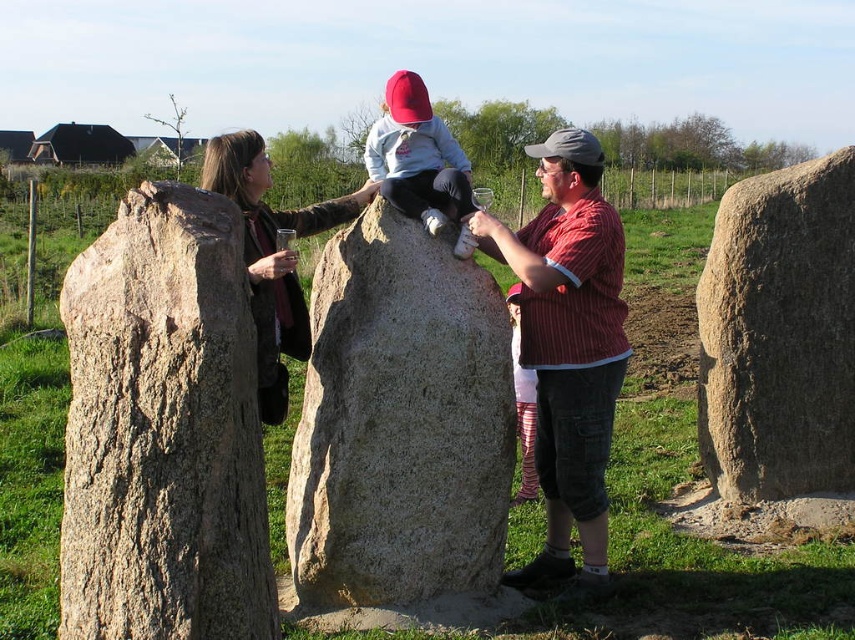
You are standing at the base of the standing stones and want to place a small offering at the point closest to you between the two points marked as point (248, 461) and point (319, 355). Which point should you go to?

Point (248, 461) is in front of point (319, 355), so you should go to point (248, 461) to place your offering.

You are a tour guide explaining the layout of the standing stones to visitors. Pointing to the rough textured stone at left and the granite boulder at center, you want to describe their positions relative to each other. Which one is higher up?

The rough textured stone at left is located above the granite boulder at center, so it is higher up.

You are a photographer trying to capture both the matte red shirt at center and the matte gray hoodie at center in a single frame. Which of the two clothing items will appear smaller in the photo?

The matte red shirt at center will appear smaller in the photo because it occupies less space than the matte gray hoodie at center.